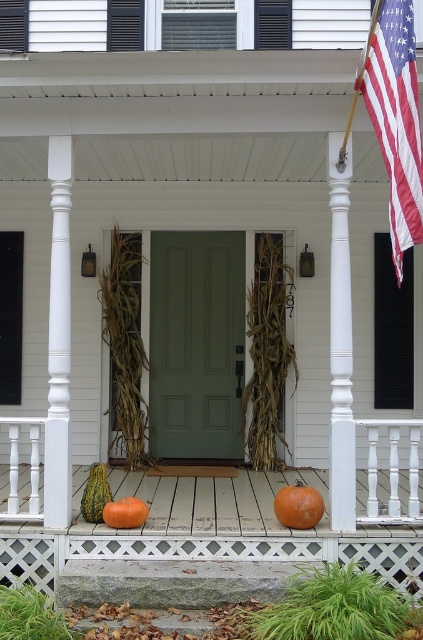
Question: Which point appears farthest from the camera in this image?

Choices:
 (A) (153, 547)
 (B) (320, 508)
 (C) (88, 499)
 (D) (165, 285)

Answer: (D)

Question: Considering the relative positions of white painted wood post at center and orange matte pumpkin at center in the image provided, where is white painted wood post at center located with respect to orange matte pumpkin at center?

Choices:
 (A) left
 (B) right

Answer: (B)

Question: Which object appears farthest from the camera in this image?

Choices:
 (A) white painted wood post at center
 (B) orange matte pumpkin at lower center
 (C) matte orange pumpkin at lower center

Answer: (A)

Question: Is american flag at upper right to the left of white painted wood post at left from the viewer's perspective?

Choices:
 (A) no
 (B) yes

Answer: (A)

Question: Is orange matte pumpkin at lower center above green matte gourd at lower left?

Choices:
 (A) no
 (B) yes

Answer: (A)

Question: Among these objects, which one is farthest from the camera?

Choices:
 (A) orange matte pumpkin at lower center
 (B) white painted wood post at center

Answer: (B)